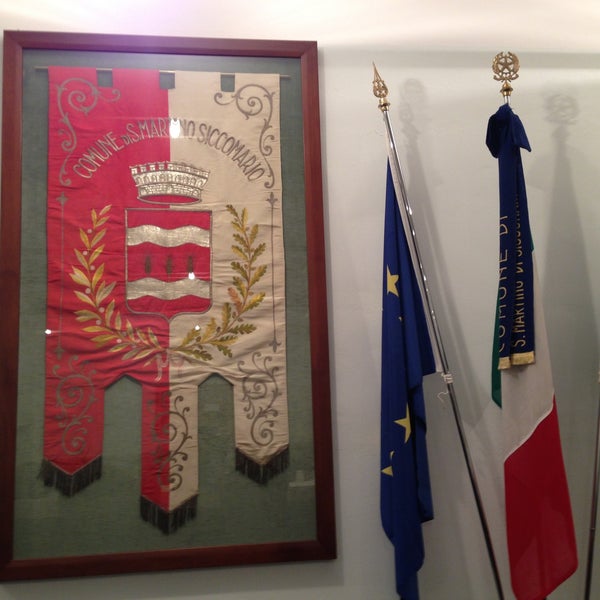
The height and width of the screenshot is (600, 600). What are the coordinates of `hanging flag in case` in the screenshot? It's located at (109, 172), (251, 274).